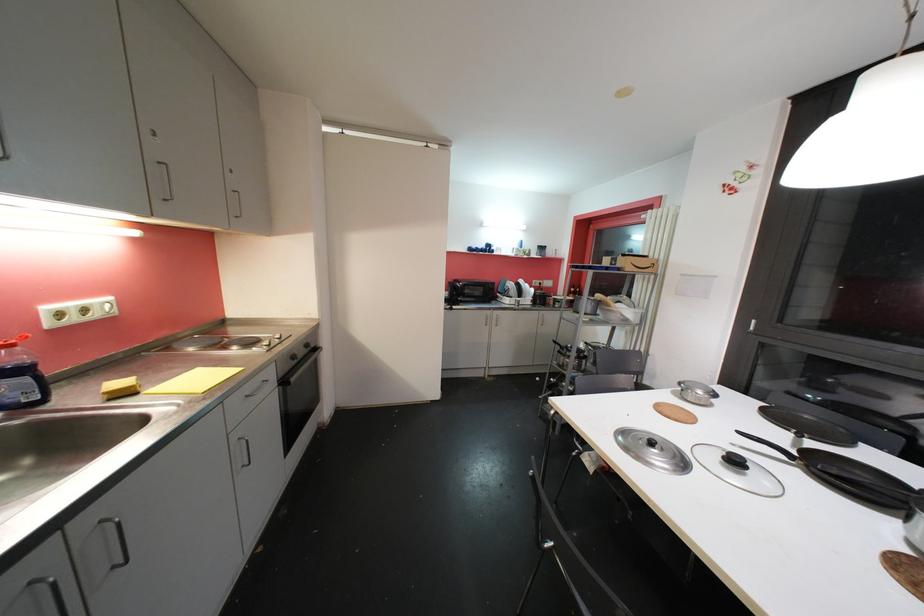
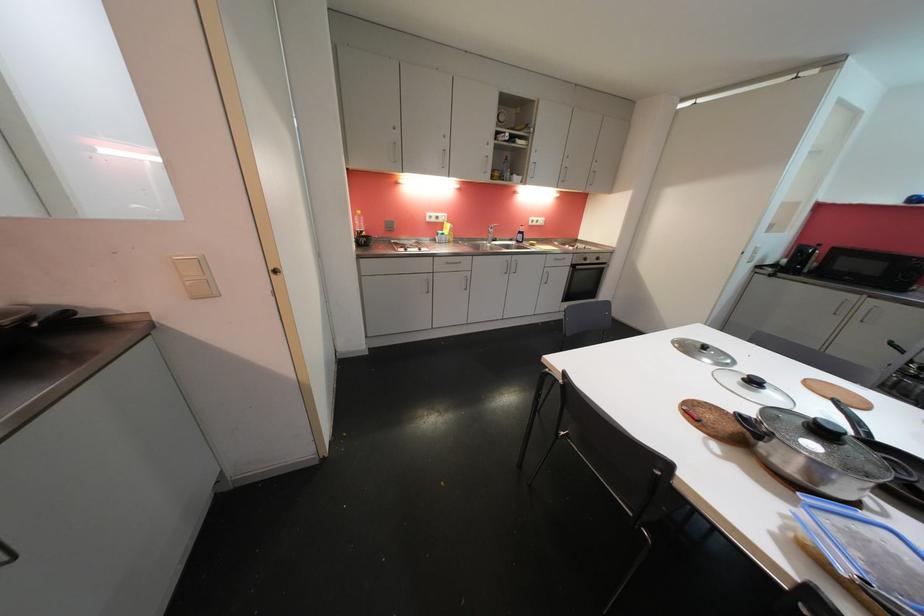
Question: I am providing you with two images of the same scene from different viewpoints. After the viewpoint changes to image2, which objects are now occluded?

Choices:
 (A) black pan handle
 (B) black pot lid handle
 (C) metal drawer handle
 (D) none of these

Answer: (D)